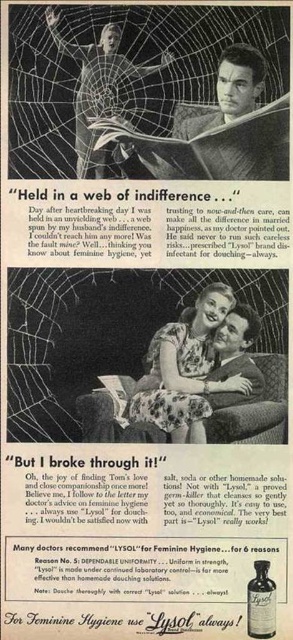
Which is above, smooth skin man at upper right or translucent glass bottle at center?

Positioned higher is smooth skin man at upper right.

Is smooth skin man at upper right below translucent glass bottle at center?

Actually, smooth skin man at upper right is above translucent glass bottle at center.

Image resolution: width=293 pixels, height=640 pixels. What do you see at coordinates (217, 131) in the screenshot? I see `smooth skin man at upper right` at bounding box center [217, 131].

Locate an element on the screen. The width and height of the screenshot is (293, 640). smooth skin man at upper right is located at coordinates (217, 131).

Based on the photo, is smooth skin man at upper right positioned before floral dress at center?

Yes, it is in front of floral dress at center.

Does point (179, 154) come behind point (154, 403)?

No, (179, 154) is closer to viewer.

Between point (138, 154) and point (162, 344), which one is positioned behind?

The point (162, 344) is behind.

Identify the location of smooth skin man at upper right. The image size is (293, 640). pyautogui.click(x=217, y=131).

Does matte black dress at upper center have a smaller size compared to translucent glass bottle at center?

No, matte black dress at upper center is not smaller than translucent glass bottle at center.

Does matte black dress at upper center appear under translucent glass bottle at center?

Incorrect, matte black dress at upper center is not positioned below translucent glass bottle at center.

Does point (101, 74) come closer to viewer compared to point (264, 625)?

No, it is behind (264, 625).

What are the coordinates of `matte black dress at upper center` in the screenshot? It's located at (97, 84).